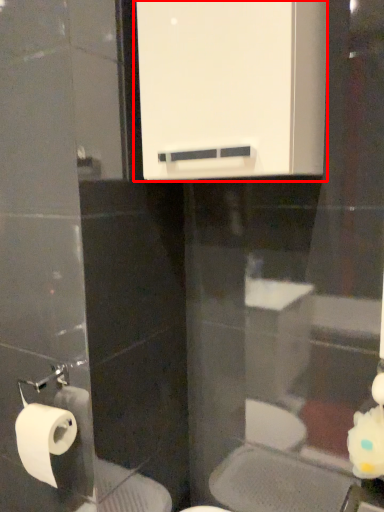
Question: Where is medicine cabinet (annotated by the red box) located in relation to toilet paper in the image?

Choices:
 (A) right
 (B) left

Answer: (A)